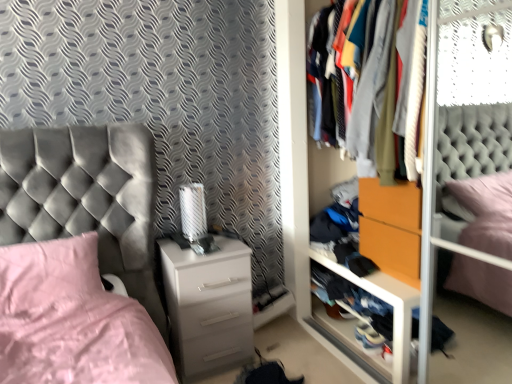
Where is `spots to the right of white glossy chest of drawers at center`? spots to the right of white glossy chest of drawers at center is located at coordinates (287, 349).